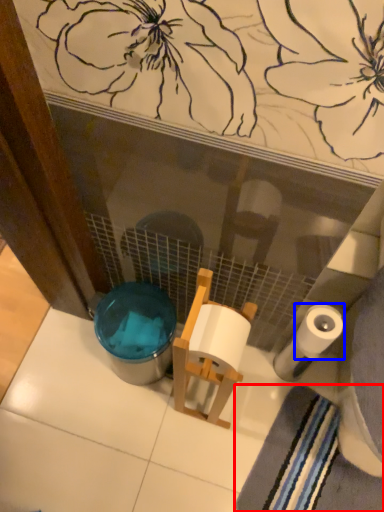
Question: Which object is further to the camera taking this photo, bath towel (highlighted by a red box) or toilet paper (highlighted by a blue box)?

Choices:
 (A) bath towel
 (B) toilet paper

Answer: (A)